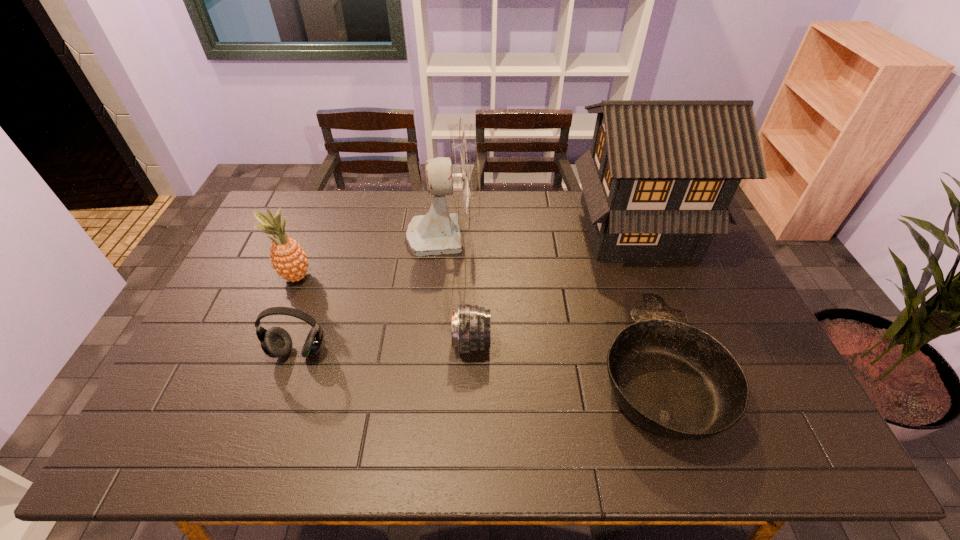
Identify which object is the nearest to the headset. Please provide its 2D coordinates. Your answer should be formatted as a tuple, i.e. [(x, y)], where the tuple contains the x and y coordinates of a point satisfying the conditions above.

[(289, 260)]

Image resolution: width=960 pixels, height=540 pixels. In order to click on object that is the fifth nearest to the headset in this screenshot , I will do `click(657, 182)`.

Identify the location of vacant region that satisfies the following two spatial constraints: 1. on the front-facing side of the dollhouse; 2. in front of the fan to blow air. The image size is (960, 540). 639,234.

At what (x,y) coordinates should I click in order to perform the action: click on blank area in the image that satisfies the following two spatial constraints: 1. on the front-facing side of the dollhouse; 2. at the front element of the telephoto lens. Please return your answer as a coordinate pair (x, y). Image resolution: width=960 pixels, height=540 pixels. Looking at the image, I should click on (681, 342).

Identify the location of free space in the image that satisfies the following two spatial constraints: 1. at the front element of the telephoto lens; 2. on the ear cups of the fourth tallest object. (471, 352).

Identify the location of vacant space that satisfies the following two spatial constraints: 1. on the front-facing side of the dollhouse; 2. at the front element of the telephoto lens. (681, 342).